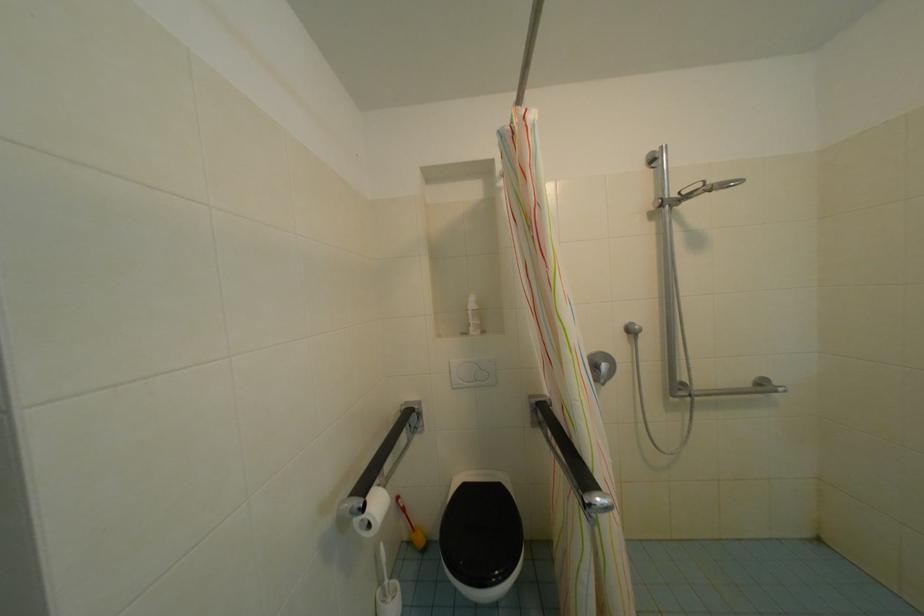
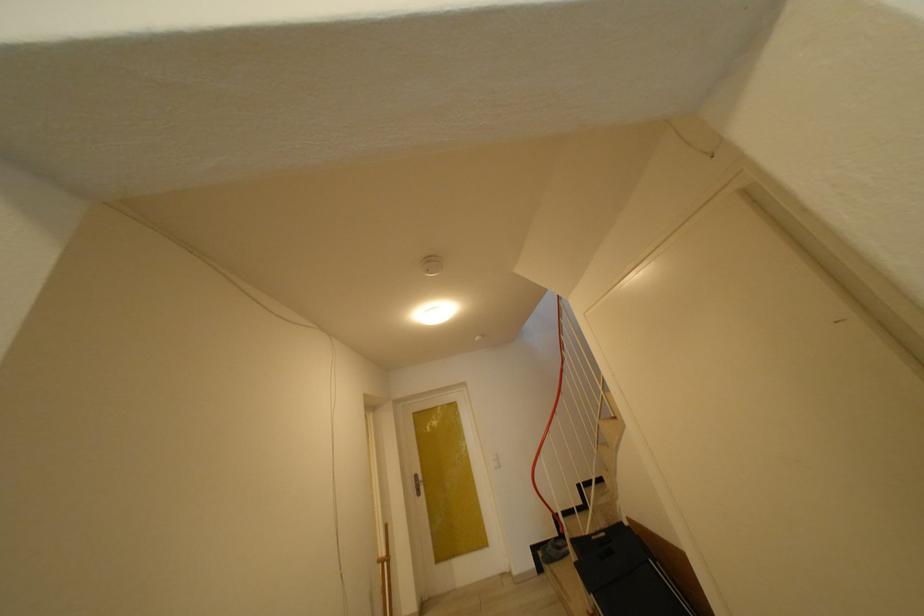
Question: In a continuous first-person perspective shot, in which direction is the camera moving?

Choices:
 (A) Left
 (B) Right
 (C) Forward
 (D) Backward

Answer: (A)